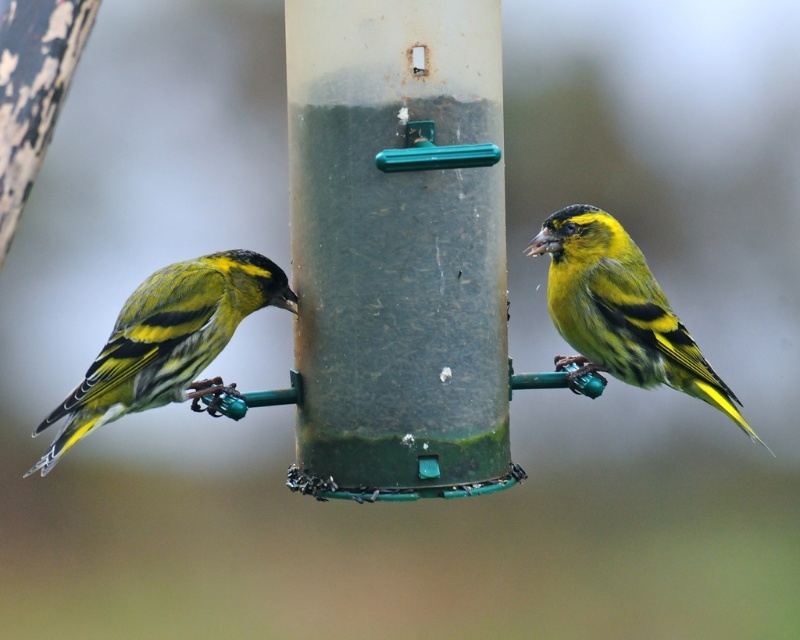
Can you confirm if green matte pole at center is positioned above green textured finch at left?

Yes.

Between green matte pole at center and green textured finch at left, which one is positioned lower?

Positioned lower is green textured finch at left.

The image size is (800, 640). I want to click on green matte pole at center, so click(397, 246).

At what (x,y) coordinates should I click in order to perform the action: click on green matte pole at center. Please return your answer as a coordinate pair (x, y). This screenshot has height=640, width=800. Looking at the image, I should click on (397, 246).

At what (x,y) coordinates should I click in order to perform the action: click on green matte pole at center. Please return your answer as a coordinate pair (x, y). Looking at the image, I should click on (397, 246).

Who is more distant from viewer, (420, 17) or (672, 352)?

Positioned behind is point (672, 352).

The image size is (800, 640). What are the coordinates of `green matte pole at center` in the screenshot? It's located at (397, 246).

Based on the photo, is green textured finch at left thinner than yellow-green feathers at right?

No, green textured finch at left is not thinner than yellow-green feathers at right.

Is point (172, 307) positioned after point (608, 264)?

No, (172, 307) is in front of (608, 264).

This screenshot has height=640, width=800. I want to click on green textured finch at left, so click(168, 340).